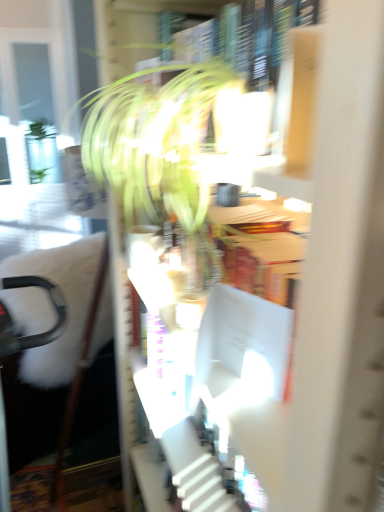
Question: From the image's perspective, is black plastic swivel chair at left above white cardboard bookcase at center?

Choices:
 (A) no
 (B) yes

Answer: (A)

Question: From a real-world perspective, is black plastic swivel chair at left positioned under white cardboard bookcase at center based on gravity?

Choices:
 (A) yes
 (B) no

Answer: (A)

Question: Can you confirm if black plastic swivel chair at left is positioned to the left of white cardboard bookcase at center?

Choices:
 (A) no
 (B) yes

Answer: (B)

Question: Does black plastic swivel chair at left appear on the right side of white cardboard bookcase at center?

Choices:
 (A) no
 (B) yes

Answer: (A)

Question: Could you tell me if black plastic swivel chair at left is turned towards white cardboard bookcase at center?

Choices:
 (A) yes
 (B) no

Answer: (B)

Question: Would you say white cardboard bookcase at center is part of black plastic swivel chair at left's contents?

Choices:
 (A) no
 (B) yes

Answer: (A)

Question: Considering the relative sizes of black plastic swivel chair at left and green leafy plant at center in the image provided, is black plastic swivel chair at left wider than green leafy plant at center?

Choices:
 (A) no
 (B) yes

Answer: (B)

Question: Considering the relative sizes of black plastic swivel chair at left and green leafy plant at center in the image provided, is black plastic swivel chair at left thinner than green leafy plant at center?

Choices:
 (A) yes
 (B) no

Answer: (B)

Question: From a real-world perspective, does black plastic swivel chair at left stand above green leafy plant at center?

Choices:
 (A) no
 (B) yes

Answer: (A)

Question: Is black plastic swivel chair at left oriented towards green leafy plant at center?

Choices:
 (A) no
 (B) yes

Answer: (A)

Question: Is black plastic swivel chair at left facing away from green leafy plant at center?

Choices:
 (A) no
 (B) yes

Answer: (A)

Question: Is black plastic swivel chair at left further to camera compared to green leafy plant at center?

Choices:
 (A) yes
 (B) no

Answer: (B)

Question: Is the surface of white cardboard bookcase at center in direct contact with green leafy plant at center?

Choices:
 (A) yes
 (B) no

Answer: (B)